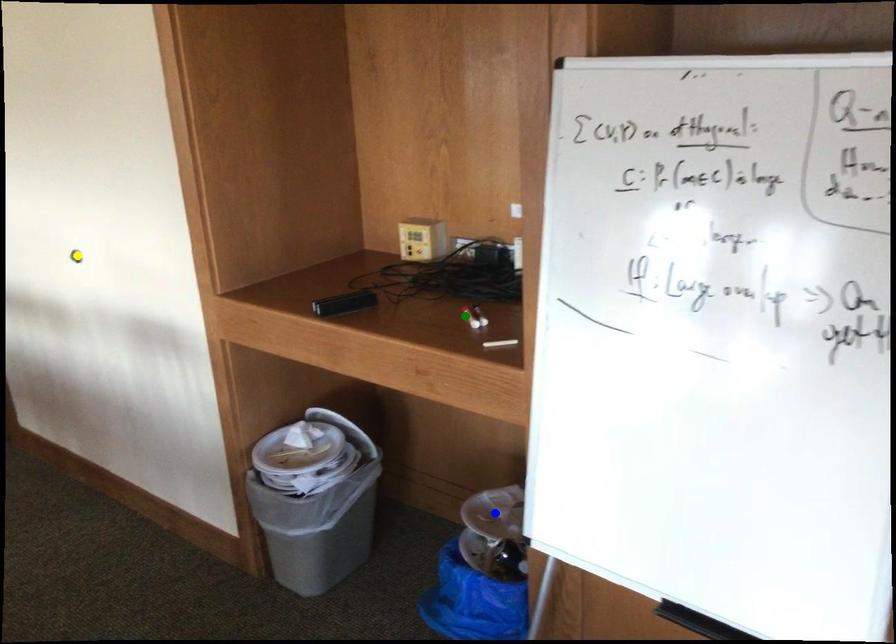
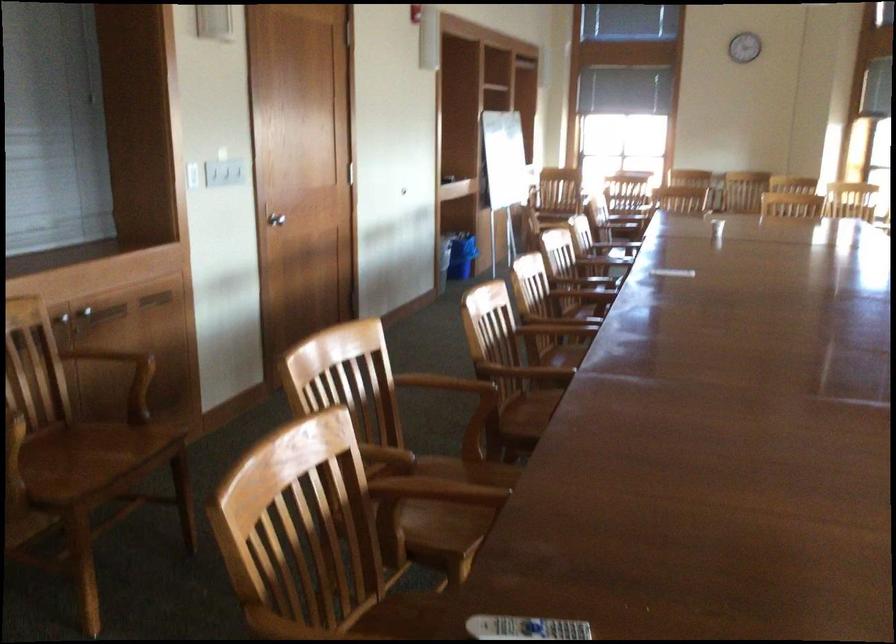
I am providing you with two images of the same scene from different viewpoints. Three points are marked in image1. Which point corresponds to a part or object that is occluded in image2?In image1, three points are marked. Which of them correspond to a part or object that is occluded in image2?Among the three points shown in image1, which one corresponds to a part or object that is no longer visible due to occlusion in image2?

green point, yellow point, blue point cannot be seen in image2.